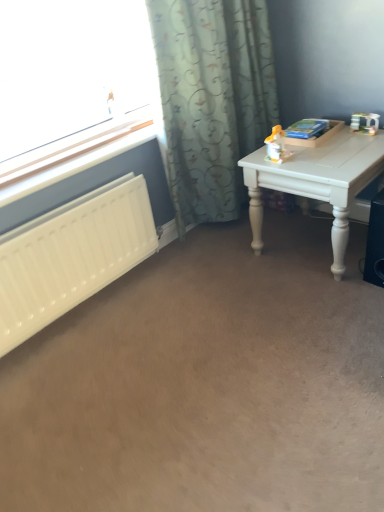
Question: Can you confirm if white plastic radiator at left is positioned to the right of yellow plastic toy at upper right?

Choices:
 (A) no
 (B) yes

Answer: (A)

Question: Is white plastic radiator at left bigger than yellow plastic toy at upper right?

Choices:
 (A) yes
 (B) no

Answer: (A)

Question: Can you confirm if white plastic radiator at left is shorter than yellow plastic toy at upper right?

Choices:
 (A) yes
 (B) no

Answer: (A)

Question: From the image's perspective, is white plastic radiator at left under yellow plastic toy at upper right?

Choices:
 (A) no
 (B) yes

Answer: (B)

Question: From the image's perspective, is white plastic radiator at left above yellow plastic toy at upper right?

Choices:
 (A) yes
 (B) no

Answer: (B)

Question: Do you think white matte radiator at left is within white painted wood table at right, or outside of it?

Choices:
 (A) outside
 (B) inside

Answer: (A)

Question: In terms of width, does white matte radiator at left look wider or thinner when compared to white painted wood table at right?

Choices:
 (A) wide
 (B) thin

Answer: (B)

Question: Considering the positions of white matte radiator at left and white painted wood table at right in the image, is white matte radiator at left taller or shorter than white painted wood table at right?

Choices:
 (A) short
 (B) tall

Answer: (A)

Question: Is white matte radiator at left to the left or to the right of white painted wood table at right in the image?

Choices:
 (A) right
 (B) left

Answer: (B)

Question: From the image's perspective, is patterned fabric curtain at upper center positioned above or below white matte radiator at left?

Choices:
 (A) above
 (B) below

Answer: (A)

Question: Does point (206, 56) appear closer or farther from the camera than point (11, 264)?

Choices:
 (A) farther
 (B) closer

Answer: (A)

Question: From a real-world perspective, is patterned fabric curtain at upper center above or below white matte radiator at left?

Choices:
 (A) below
 (B) above

Answer: (B)

Question: Is patterned fabric curtain at upper center in front of or behind white matte radiator at left in the image?

Choices:
 (A) behind
 (B) front

Answer: (A)

Question: From their relative heights in the image, would you say yellow plastic toy at upper right is taller or shorter than black plastic speaker at lower right?

Choices:
 (A) short
 (B) tall

Answer: (A)

Question: In terms of width, does yellow plastic toy at upper right look wider or thinner when compared to black plastic speaker at lower right?

Choices:
 (A) thin
 (B) wide

Answer: (A)